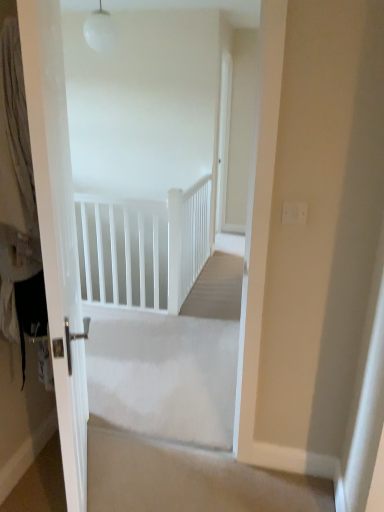
Question: Is white fabric curtain at left in front of or behind beige carpet at center in the image?

Choices:
 (A) behind
 (B) front

Answer: (B)

Question: Is white fabric curtain at left to the left or to the right of beige carpet at center in the image?

Choices:
 (A) right
 (B) left

Answer: (B)

Question: Which object is positioned closest to the beige carpet at center?

Choices:
 (A) white matte rail at upper center
 (B) white fabric curtain at left
 (C) white glossy door at left

Answer: (C)

Question: Estimate the real-world distances between objects in this image. Which object is closer to the white matte rail at upper center?

Choices:
 (A) white glossy door at left
 (B) beige carpet at center
 (C) white fabric curtain at left

Answer: (A)